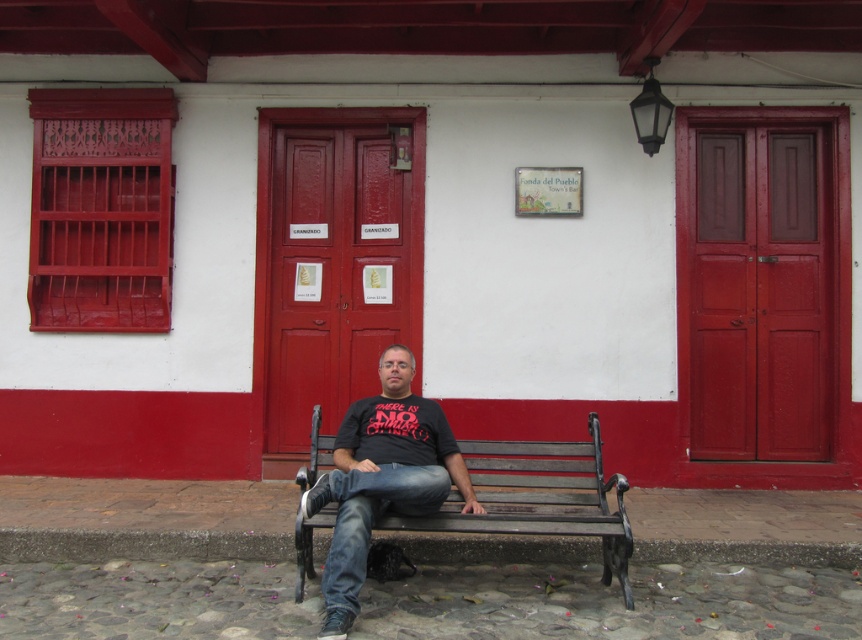
Question: Among these points, which one is nearest to the camera?

Choices:
 (A) (373, 484)
 (B) (613, 524)

Answer: (A)

Question: Which point appears farthest from the camera in this image?

Choices:
 (A) (520, 518)
 (B) (317, 486)

Answer: (A)

Question: Is black matte shirt at center wider than wooden bench at center?

Choices:
 (A) yes
 (B) no

Answer: (B)

Question: Among these objects, which one is nearest to the camera?

Choices:
 (A) black matte shirt at center
 (B) wooden bench at center

Answer: (A)

Question: Can you confirm if black matte shirt at center is positioned to the right of wooden bench at center?

Choices:
 (A) yes
 (B) no

Answer: (B)

Question: Does black matte shirt at center appear under wooden bench at center?

Choices:
 (A) yes
 (B) no

Answer: (B)